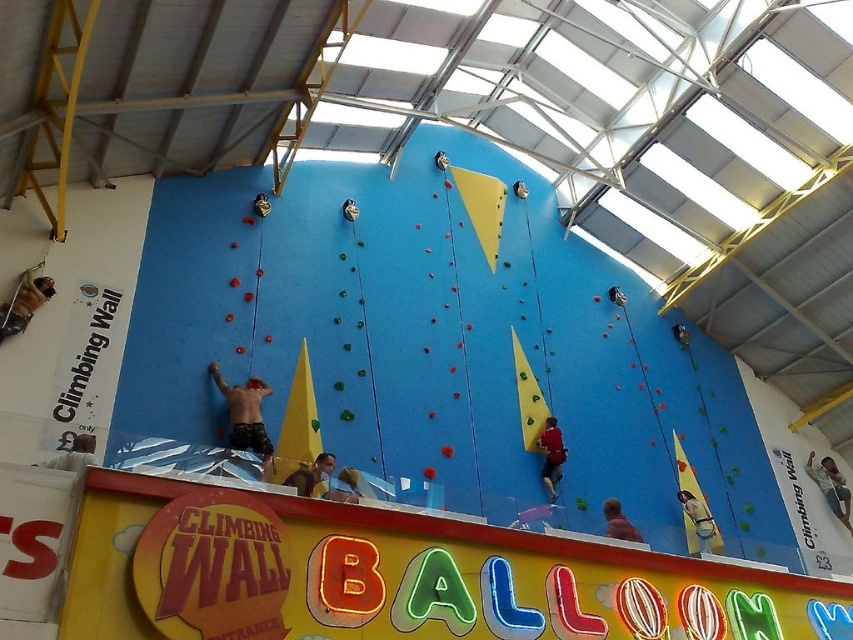
Describe the element at coordinates (22, 301) in the screenshot. The width and height of the screenshot is (853, 640). I see `shiny black shorts at upper left` at that location.

Image resolution: width=853 pixels, height=640 pixels. What are the coordinates of `shiny black shorts at upper left` in the screenshot? It's located at (22, 301).

Does shiny black shorts at upper left appear under light blue shirt at upper center?

No, shiny black shorts at upper left is not below light blue shirt at upper center.

Between point (0, 340) and point (811, 465), which one is positioned behind?

The point (811, 465) is behind.

Locate an element on the screen. shiny black shorts at upper left is located at coordinates (22, 301).

Can you confirm if light blue shirt at upper center is shorter than smooth skin person at center?

No.

Is light blue shirt at upper center above smooth skin person at center?

No, light blue shirt at upper center is not above smooth skin person at center.

Which is behind, point (813, 474) or point (322, 493)?

Point (813, 474)

Find the location of `light blue shirt at upper center`. light blue shirt at upper center is located at coordinates (831, 486).